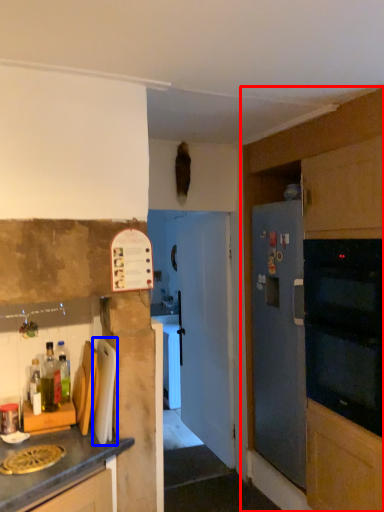
Question: Among these objects, which one is farthest to the camera, cabinetry (highlighted by a red box) or appliance (highlighted by a blue box)?

Choices:
 (A) cabinetry
 (B) appliance

Answer: (A)